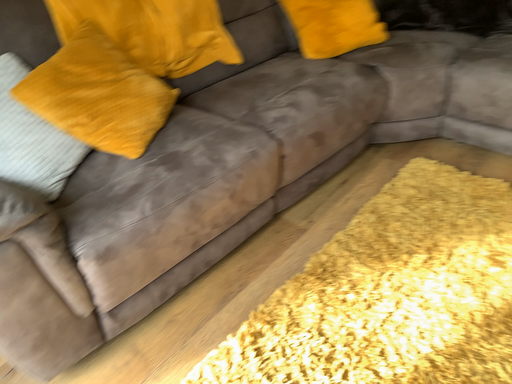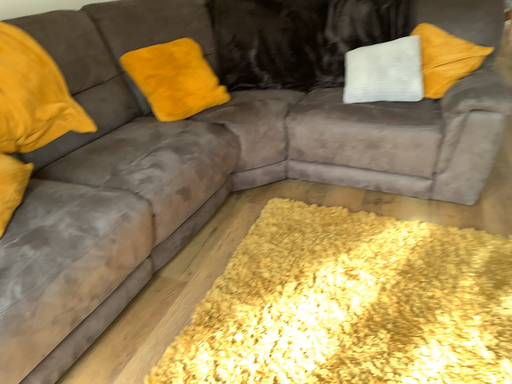
Question: Which way did the camera rotate in the video?

Choices:
 (A) rotated upward
 (B) rotated downward

Answer: (A)